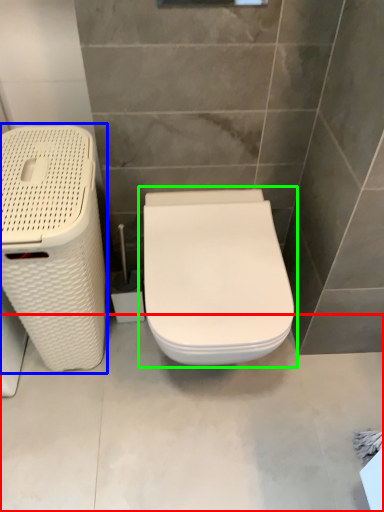
Question: Which is farther away from concrete (highlighted by a red box)? laundry basket (highlighted by a blue box) or toilet (highlighted by a green box)?

Choices:
 (A) laundry basket
 (B) toilet

Answer: (A)